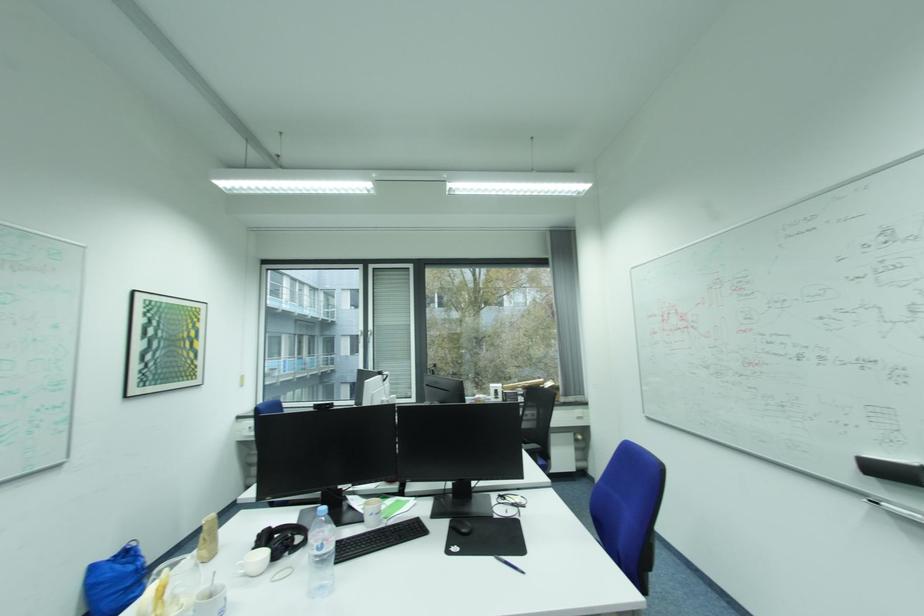
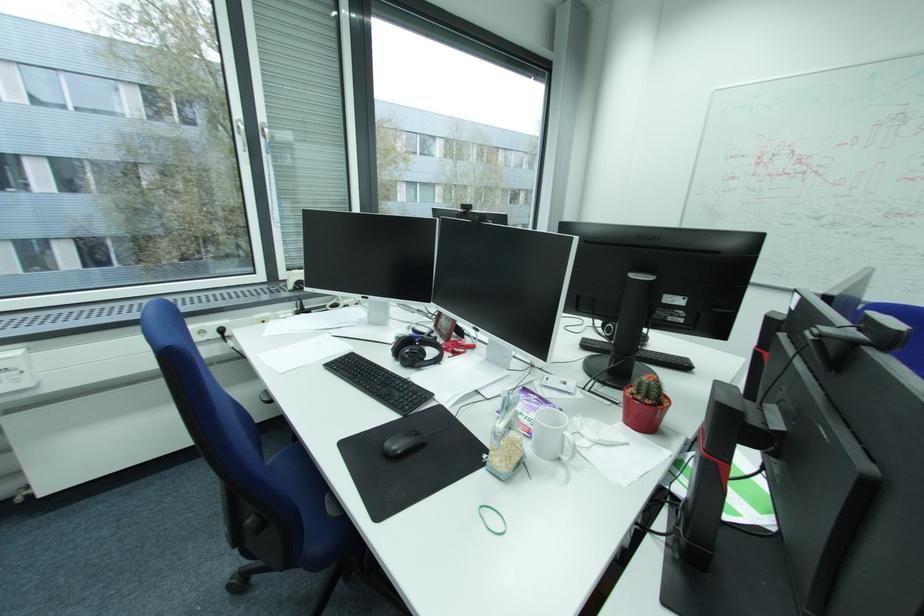
In the second image, find the point that corresponds to pixel 370 331 in the first image.

(247, 121)